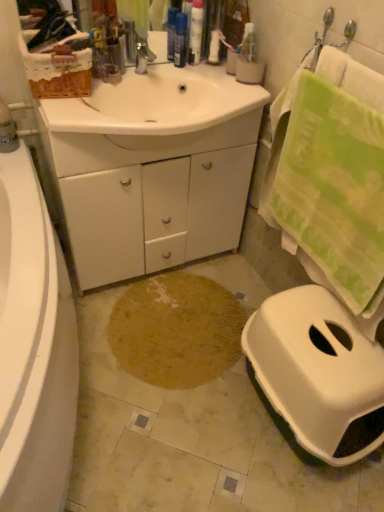
Identify the location of free space above brown textured rug at center (from a real-world perspective). (172, 320).